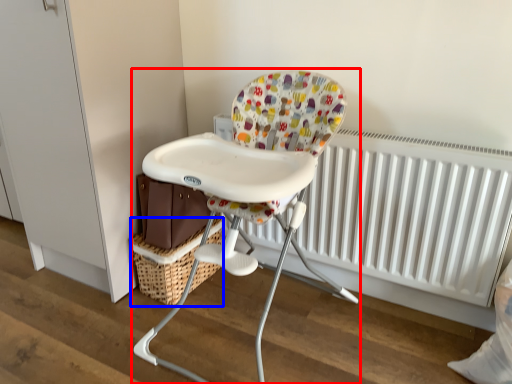
Question: Which object appears farthest to the camera in this image, chair (highlighted by a red box) or basket (highlighted by a blue box)?

Choices:
 (A) chair
 (B) basket

Answer: (B)